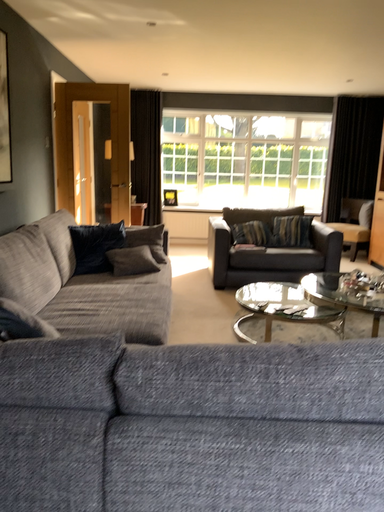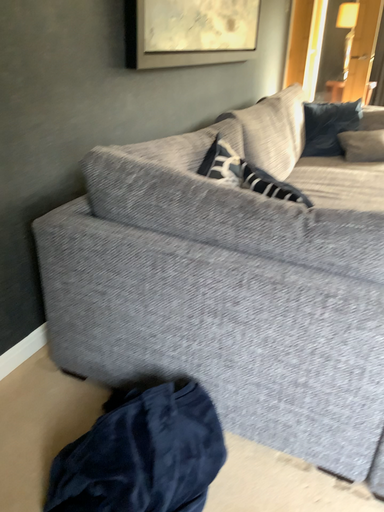
Question: Which way did the camera rotate in the video?

Choices:
 (A) rotated right
 (B) rotated left

Answer: (B)